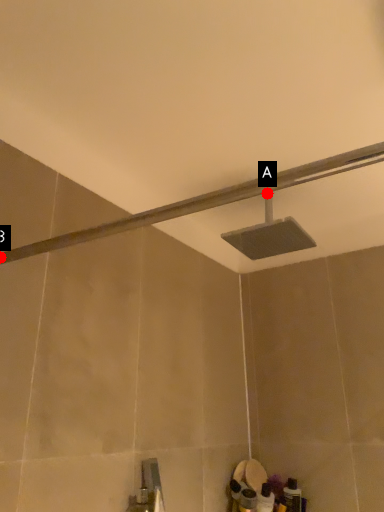
Question: Two points are circled on the image, labeled by A and B beside each circle. Which point is farther to the camera?

Choices:
 (A) A is further
 (B) B is further

Answer: (A)